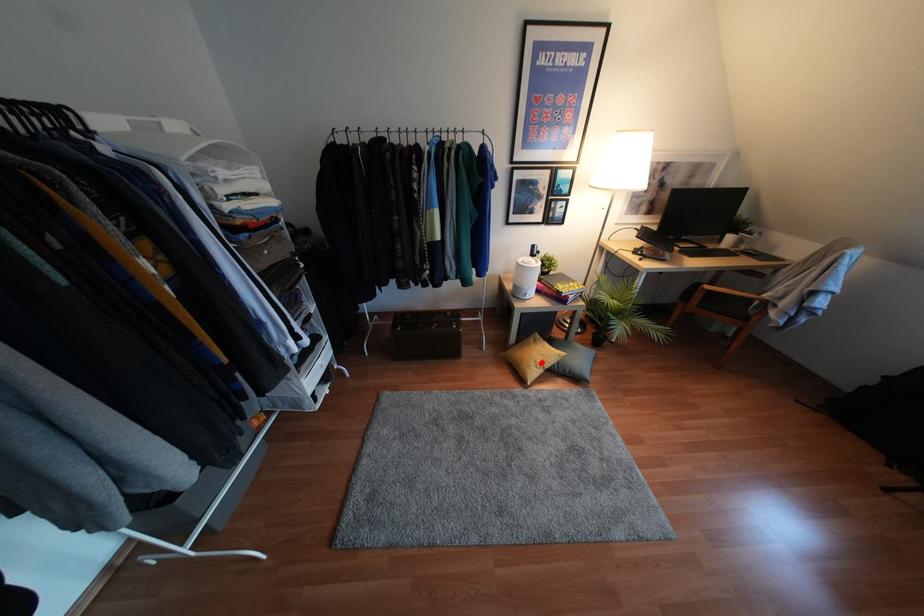
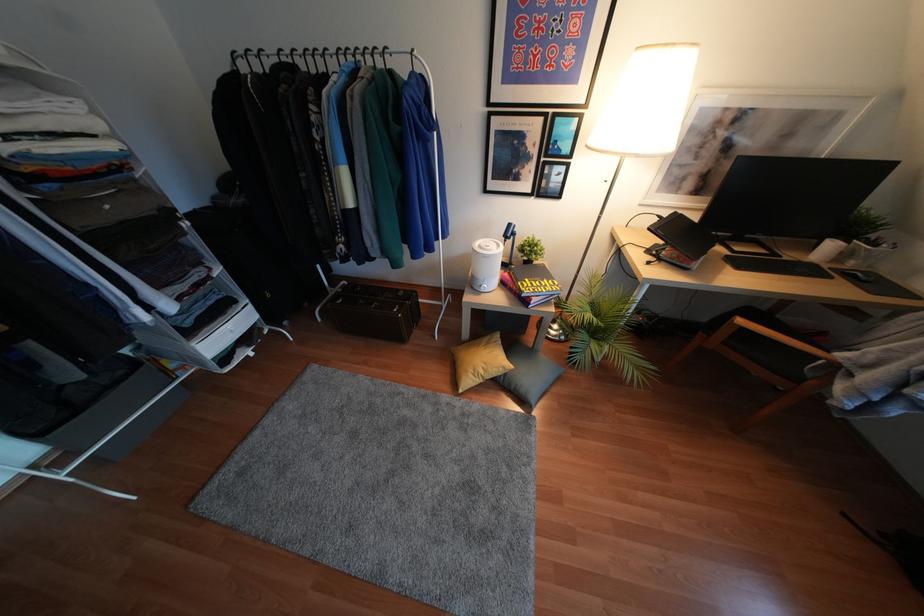
Locate, in the second image, the point that corresponds to the highlighted location in the first image.

(480, 371)